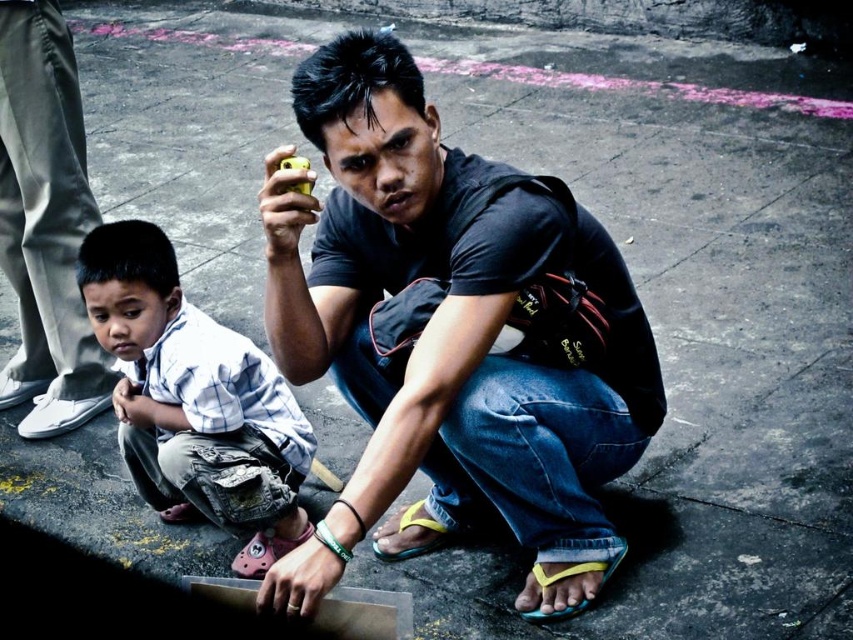
You are a photographer trying to capture a candid shot of the black matte shirt at center and the white checkered shirt at lower left. Which shirt should you focus on first if you want to ensure both are in sharp focus?

The black matte shirt at center is in front of the white checkered shirt at lower left, so you should focus on the black matte shirt at center first to ensure both are in sharp focus.

You are trying to decide which black matte shirt to wear for a casual day out. Both the black matte shirt at center and the matte black shirt at lower center are options. Which one should you choose if you want the larger size?

The black matte shirt at center is bigger than the matte black shirt at lower center, so you should choose the black matte shirt at center for the larger size.

What are the coordinates of the black matte shirt at center?

The coordinates of the black matte shirt at center are at point (451, 336).